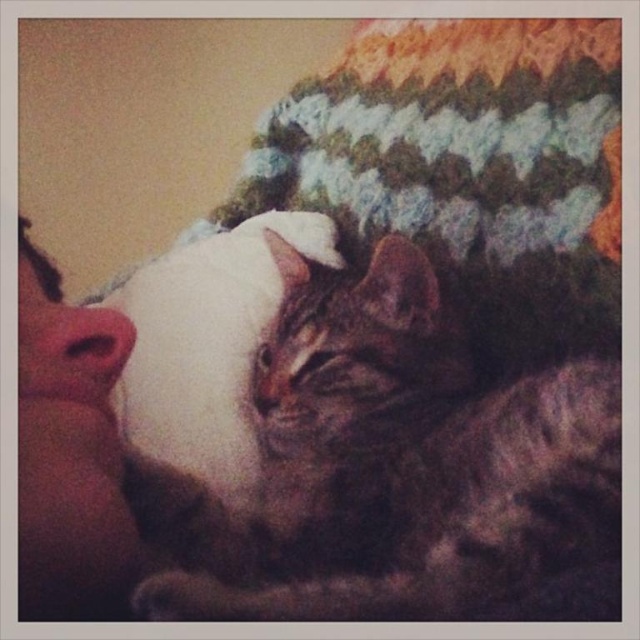
You are designing a new pet bed for cats and want to ensure it can accommodate both the tabby fur cat at center and the white fluffy pillow at center. Based on the image, which object takes up more space?

The white fluffy pillow at center takes up more space than the tabby fur cat at center because the tabby fur cat at center occupies less space than white fluffy pillow at center.

You are an animal behaviorist observing the scene. The tabby fur cat at center is positioned in a specific location. Can you determine if the cat is closer to the person or farther away based on its coordinates?

The tabby fur cat at center is located at point [394,467], which places it centrally and slightly towards the right, indicating it is resting against the person and thus close to them.